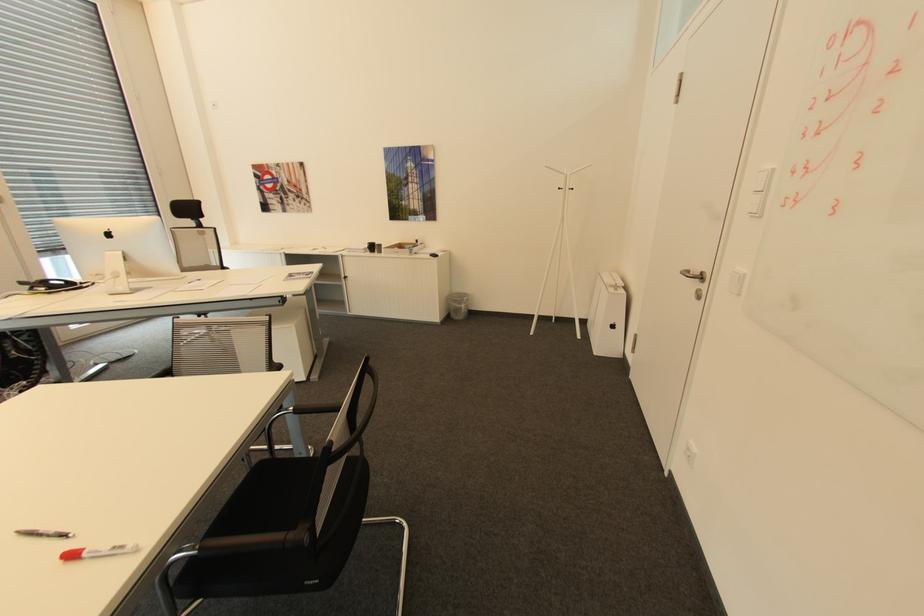
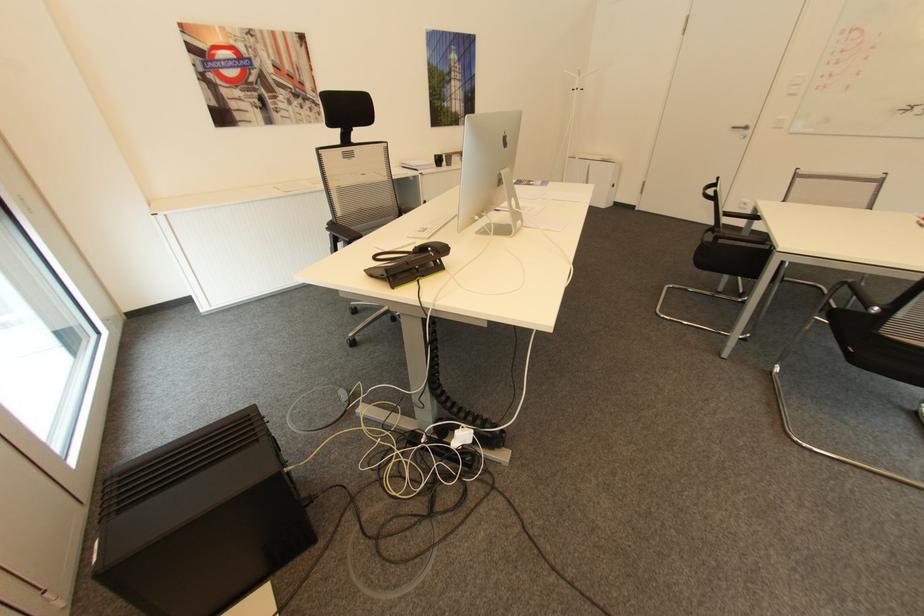
The point at (x=689, y=272) is marked in the first image. Where is the corresponding point in the second image?

(736, 128)